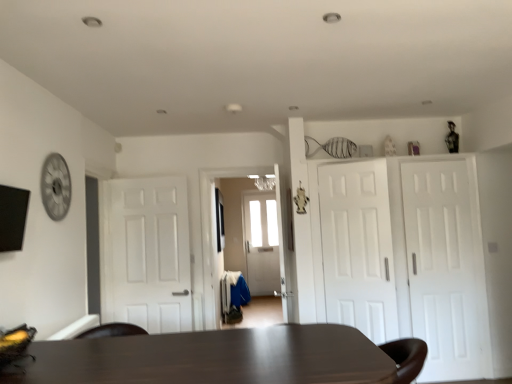
Question: Relative to white matte door at right, which is counted as the 1th door, starting from the right, is dark brown wooden table at center in front or behind?

Choices:
 (A) front
 (B) behind

Answer: (A)

Question: In terms of size, does dark brown wooden table at center appear bigger or smaller than white matte door at right, positioned as the 4th door in left-to-right order?

Choices:
 (A) small
 (B) big

Answer: (B)

Question: Which object is positioned closest to the white matte door at center, acting as the 2th door starting from the left?

Choices:
 (A) metallic silver clock at upper left
 (B) white matte door at center, arranged as the 1th door when viewed from the left
 (C) white matte door at right, which is counted as the 1th door, starting from the right
 (D) dark brown wooden table at center
 (E) white matte door at right, the 3th door in the left-to-right sequence

Answer: (E)

Question: Which object is the closest to the white matte door at right, positioned as the 4th door in left-to-right order?

Choices:
 (A) metallic silver clock at upper left
 (B) dark brown wooden table at center
 (C) white matte door at center, which appears as the 3th door when viewed from the right
 (D) white matte door at right, which is the 2th door in right-to-left order
 (E) white matte door at center, arranged as the 1th door when viewed from the left

Answer: (D)